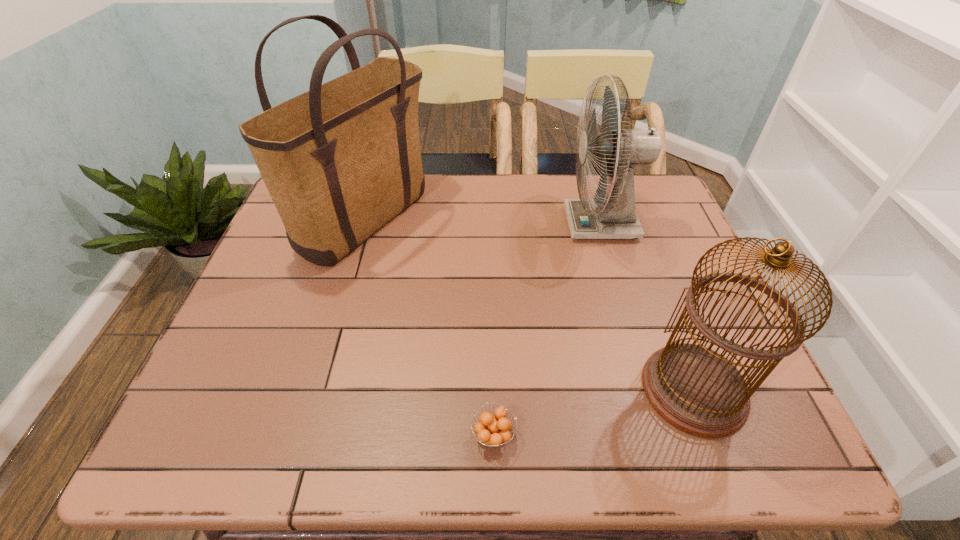
Locate an element on the screen. vacant region located on the front-facing side of the birdcage is located at coordinates (599, 389).

The image size is (960, 540). What are the coordinates of `vacant region located 0.100m on the front-facing side of the birdcage` in the screenshot? It's located at (594, 389).

Locate an element on the screen. The height and width of the screenshot is (540, 960). vacant space located on the front-facing side of the birdcage is located at coordinates (462, 389).

Locate an element on the screen. vacant area situated 0.080m on the right of the shortest object is located at coordinates (558, 435).

This screenshot has width=960, height=540. What are the coordinates of `tote bag that is at the far edge` in the screenshot? It's located at (341, 160).

Identify the location of fan located at the far edge. (615, 217).

This screenshot has width=960, height=540. I want to click on birdcage positioned at the near edge, so click(x=697, y=390).

Locate an element on the screen. The height and width of the screenshot is (540, 960). orange fruit that is at the near edge is located at coordinates [492, 431].

Locate an element on the screen. The height and width of the screenshot is (540, 960). object at the left edge is located at coordinates (341, 160).

Image resolution: width=960 pixels, height=540 pixels. What are the coordinates of `fan at the right edge` in the screenshot? It's located at (615, 217).